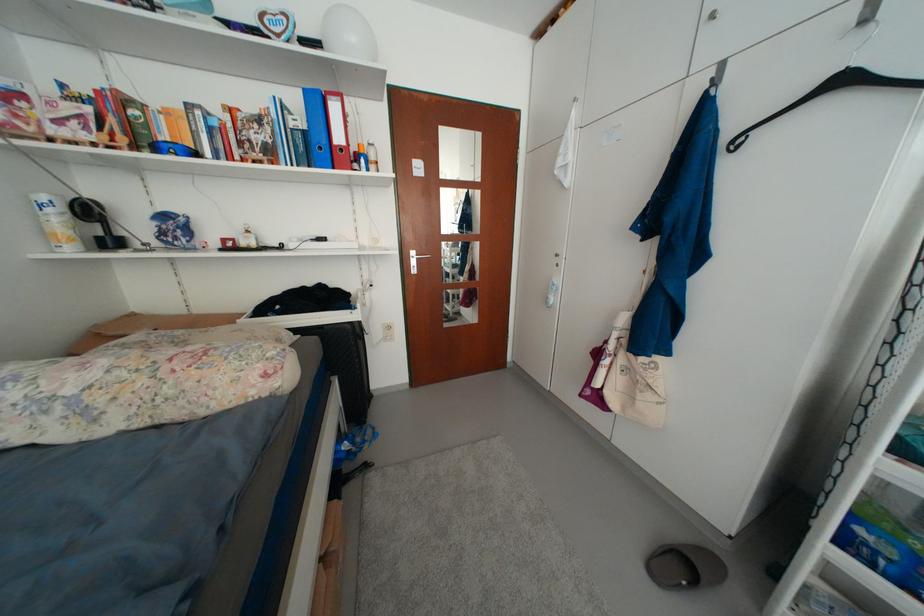
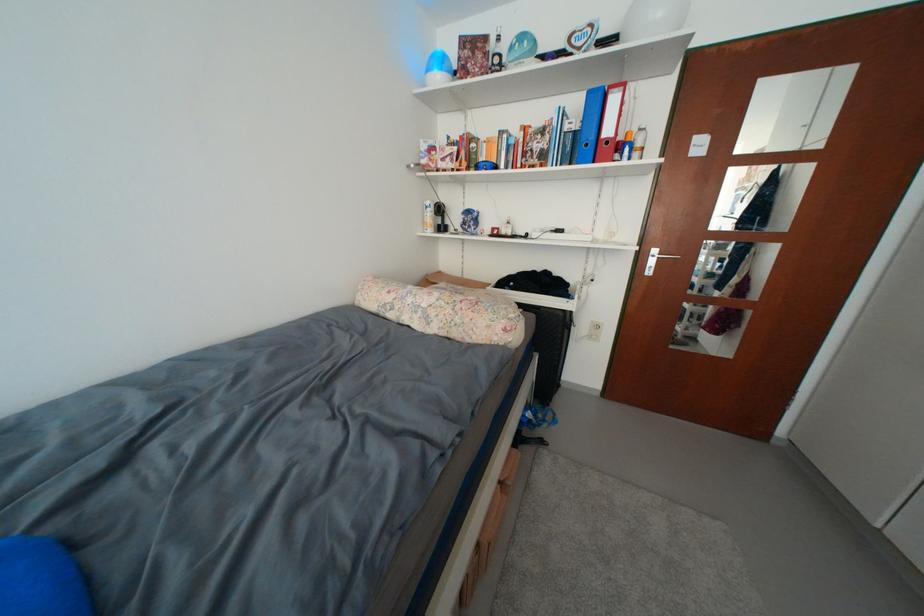
Find the pixel in the second image that matches [344,110] in the first image.

(623, 103)